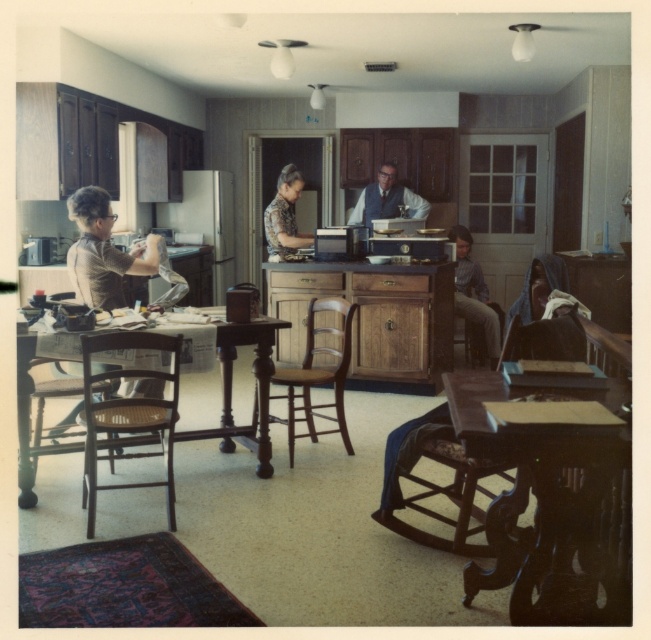
Is floral shirt at center positioned at the back of woven wood chair at lower right?

No.

What do you see at coordinates (284, 216) in the screenshot? The height and width of the screenshot is (640, 651). I see `floral shirt at center` at bounding box center [284, 216].

The image size is (651, 640). What are the coordinates of `floral shirt at center` in the screenshot? It's located at (284, 216).

Does woven cane chair at left come in front of woven wood chair at lower right?

Yes, it is in front of woven wood chair at lower right.

How distant is woven cane chair at left from woven wood chair at lower right?

woven cane chair at left and woven wood chair at lower right are 3.58 meters apart from each other.

Locate an element on the screen. woven cane chair at left is located at coordinates (128, 413).

Locate an element on the screen. This screenshot has width=651, height=640. woven cane chair at left is located at coordinates (128, 413).

Who is more forward, (x=299, y=417) or (x=409, y=216)?

Point (x=299, y=417) is in front.

Is wooden chair at center smaller than matte black vest at center?

Actually, wooden chair at center might be larger than matte black vest at center.

Which is in front, point (312, 317) or point (380, 188)?

Point (312, 317) is more forward.

You are a GUI agent. You are given a task and a screenshot of the screen. Output one action in this format:
    pyautogui.click(x=<x>, y=<y>)
    Task: Click on the wooden chair at center
    Image resolution: width=651 pixels, height=640 pixels.
    Given the screenshot: What is the action you would take?
    [316, 376]